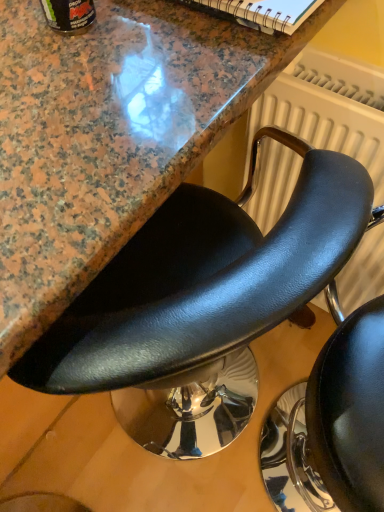
Question: Is black leather chair at center, marked as the 2th chair in a left-to-right arrangement, turned away from white textured radiator at upper right?

Choices:
 (A) yes
 (B) no

Answer: (B)

Question: Considering the relative positions of black leather chair at center, marked as the 2th chair in a left-to-right arrangement, and white textured radiator at upper right in the image provided, is black leather chair at center, marked as the 2th chair in a left-to-right arrangement, in front of white textured radiator at upper right?

Choices:
 (A) yes
 (B) no

Answer: (A)

Question: From the image's perspective, does black leather chair at center, the 1th chair viewed from the right, appear lower than white textured radiator at upper right?

Choices:
 (A) no
 (B) yes

Answer: (B)

Question: From a real-world perspective, is black leather chair at center, the 1th chair viewed from the right, under white textured radiator at upper right?

Choices:
 (A) no
 (B) yes

Answer: (B)

Question: Considering the relative sizes of black leather chair at center, the 1th chair viewed from the right, and white textured radiator at upper right in the image provided, is black leather chair at center, the 1th chair viewed from the right, bigger than white textured radiator at upper right?

Choices:
 (A) no
 (B) yes

Answer: (B)

Question: From the image's perspective, is black leather chair at center, arranged as the first chair when viewed from the left, located above or below white textured radiator at upper right?

Choices:
 (A) above
 (B) below

Answer: (B)

Question: From their relative heights in the image, would you say black leather chair at center, arranged as the first chair when viewed from the left, is taller or shorter than white textured radiator at upper right?

Choices:
 (A) tall
 (B) short

Answer: (A)

Question: From a real-world perspective, is black leather chair at center, arranged as the first chair when viewed from the left, above or below white textured radiator at upper right?

Choices:
 (A) above
 (B) below

Answer: (B)

Question: Looking at their shapes, would you say black leather chair at center, the second chair positioned from the right, is wider or thinner than white textured radiator at upper right?

Choices:
 (A) thin
 (B) wide

Answer: (B)

Question: From the image's perspective, relative to black leather chair at center, the 1th chair viewed from the right, is black leather chair at center, arranged as the first chair when viewed from the left, above or below?

Choices:
 (A) above
 (B) below

Answer: (A)

Question: Do you think black leather chair at center, the second chair positioned from the right, is within black leather chair at center, marked as the 2th chair in a left-to-right arrangement, or outside of it?

Choices:
 (A) outside
 (B) inside

Answer: (A)

Question: Is point (105, 375) positioned closer to the camera than point (288, 485)?

Choices:
 (A) closer
 (B) farther

Answer: (A)

Question: Considering the positions of black leather chair at center, arranged as the first chair when viewed from the left, and black leather chair at center, marked as the 2th chair in a left-to-right arrangement, in the image, is black leather chair at center, arranged as the first chair when viewed from the left, bigger or smaller than black leather chair at center, marked as the 2th chair in a left-to-right arrangement,?

Choices:
 (A) big
 (B) small

Answer: (A)

Question: In terms of width, does white textured radiator at upper right look wider or thinner when compared to black leather chair at center, the 1th chair viewed from the right?

Choices:
 (A) wide
 (B) thin

Answer: (B)

Question: Is white textured radiator at upper right situated inside black leather chair at center, marked as the 2th chair in a left-to-right arrangement, or outside?

Choices:
 (A) outside
 (B) inside

Answer: (A)